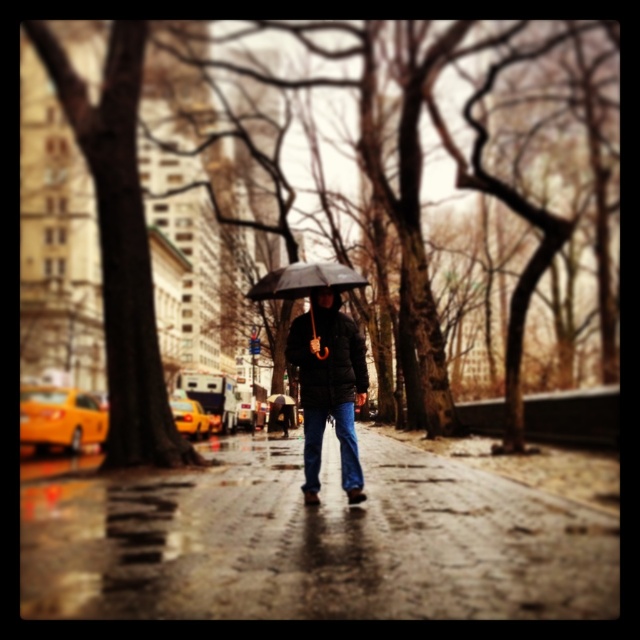
You are a fashion designer observing the rainy urban scene. You notice the matte black jacket at center and the black matte umbrella at center. Which object appears taller in the image?

The matte black jacket at center appears taller than the black matte umbrella at center in the image.

You are standing on a rainy street and see a person walking away holding an umbrella. There is a wet asphalt sidewalk at center and a matte black jacket at center. Which object is positioned to the right of the other?

The wet asphalt sidewalk at center is to the right of the matte black jacket at center.